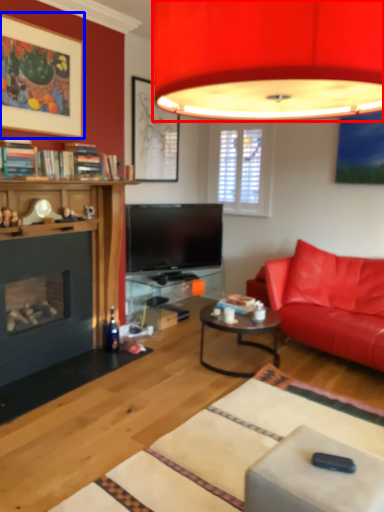
Question: Which point is closer to the camera, lamp (highlighted by a red box) or picture frame (highlighted by a blue box)?

Choices:
 (A) lamp
 (B) picture frame

Answer: (A)